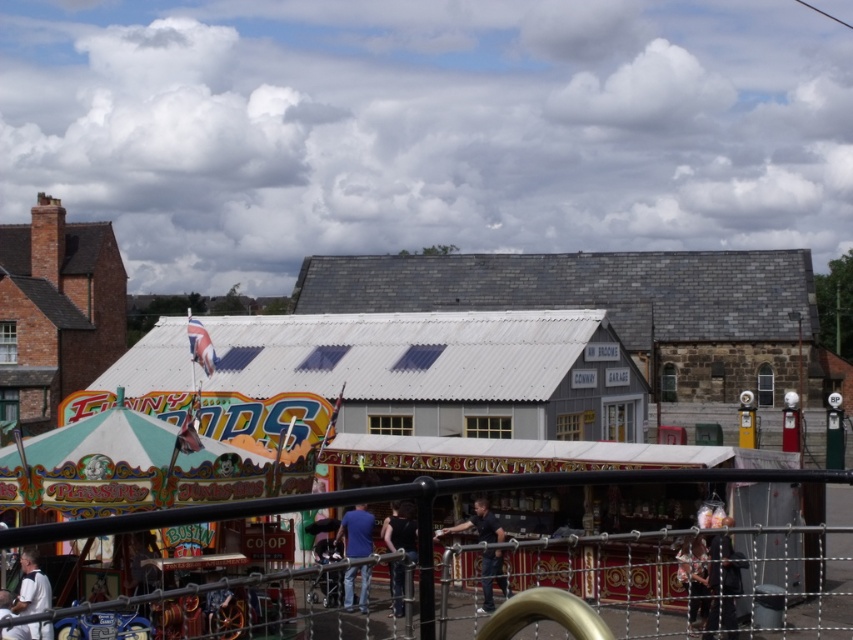
Question: Which point appears closest to the camera in this image?

Choices:
 (A) (363, 611)
 (B) (42, 621)
 (C) (9, 596)
 (D) (491, 564)

Answer: (B)

Question: Is dark blue jeans at center positioned at the back of light blue jeans at lower left?

Choices:
 (A) no
 (B) yes

Answer: (B)

Question: Can you confirm if metallic chain-link fence at lower center is positioned above dark blue jeans at center?

Choices:
 (A) yes
 (B) no

Answer: (B)

Question: Which object is closer to the camera taking this photo?

Choices:
 (A) light blue jeans at lower left
 (B) dark blue shirt at center

Answer: (A)

Question: Considering the relative positions of dark blue jeans at center and white shirt at lower left in the image provided, where is dark blue jeans at center located with respect to white shirt at lower left?

Choices:
 (A) below
 (B) above

Answer: (B)

Question: Among these points, which one is nearest to the camera?

Choices:
 (A) (350, 536)
 (B) (24, 637)
 (C) (399, 561)
 (D) (39, 579)

Answer: (C)